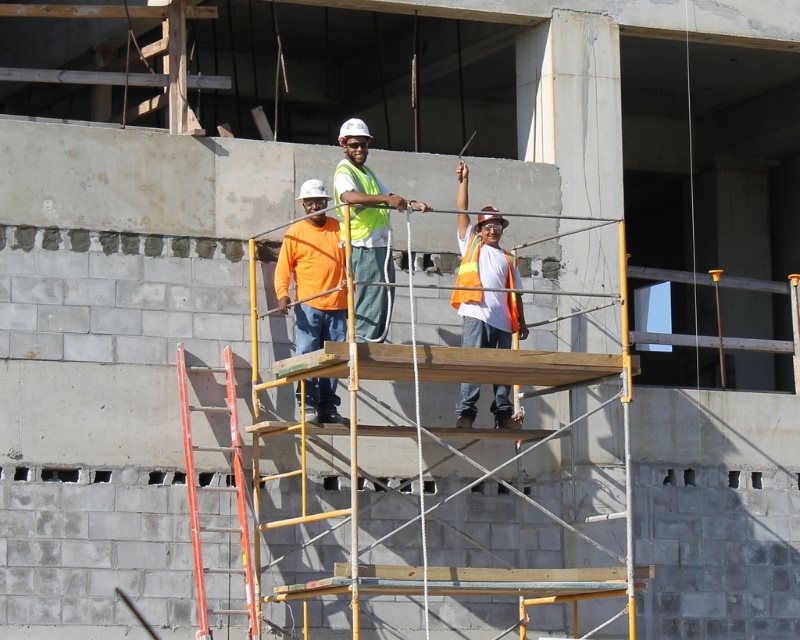
Who is taller, orange matte shirt at center or orange reflective safety vest at center?

orange matte shirt at center is taller.

Does orange matte shirt at center have a greater width compared to orange reflective safety vest at center?

Yes.

Does point (281, 296) lie in front of point (498, 300)?

Yes, it is.

Locate an element on the screen. This screenshot has width=800, height=640. orange matte shirt at center is located at coordinates (310, 250).

Who is positioned more to the right, orange reflective vest at center or high visibility vest at center?

From the viewer's perspective, orange reflective vest at center appears more on the right side.

Consider the image. Who is more distant from viewer, (496, 288) or (384, 246)?

The point (496, 288) is behind.

Where is `orange reflective vest at center`? The width and height of the screenshot is (800, 640). orange reflective vest at center is located at coordinates (484, 276).

This screenshot has height=640, width=800. I want to click on orange reflective vest at center, so click(x=484, y=276).

In the scene shown: Between orange reflective vest at center and orange painted wood ladder at left, which one is positioned lower?

orange painted wood ladder at left is below.

Is point (520, 323) positioned behind point (246, 611)?

Yes, point (520, 323) is behind point (246, 611).

Locate an element on the screen. The width and height of the screenshot is (800, 640). orange reflective vest at center is located at coordinates (484, 276).